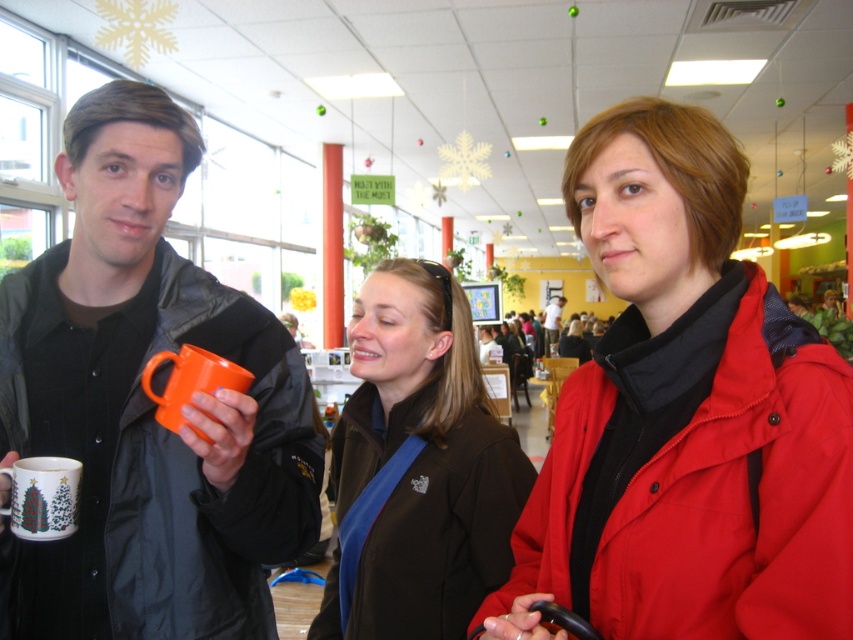
From the picture: Does porcelain christmas tree mug at center appear on the right side of matte orange mug at center?

In fact, porcelain christmas tree mug at center is to the left of matte orange mug at center.

Describe the element at coordinates (44, 497) in the screenshot. I see `porcelain christmas tree mug at center` at that location.

The height and width of the screenshot is (640, 853). I want to click on porcelain christmas tree mug at center, so click(44, 497).

Can you confirm if matte red jacket at center is smaller than matte orange mug at left?

Correct, matte red jacket at center occupies less space than matte orange mug at left.

Who is more forward, (x=779, y=625) or (x=146, y=243)?

Point (x=779, y=625) is in front.

Between point (701, 369) and point (102, 257), which one is positioned in front?

Point (701, 369) is more forward.

Locate an element on the screen. The image size is (853, 640). matte red jacket at center is located at coordinates (683, 417).

Who is taller, brown softshell jacket at center or matte orange mug at center?

matte orange mug at center is taller.

Is brown softshell jacket at center closer to the viewer compared to matte orange mug at center?

Yes, brown softshell jacket at center is in front of matte orange mug at center.

Who is more forward, (450, 508) or (548, 310)?

Point (450, 508)

Locate an element on the screen. The width and height of the screenshot is (853, 640). brown softshell jacket at center is located at coordinates (416, 467).